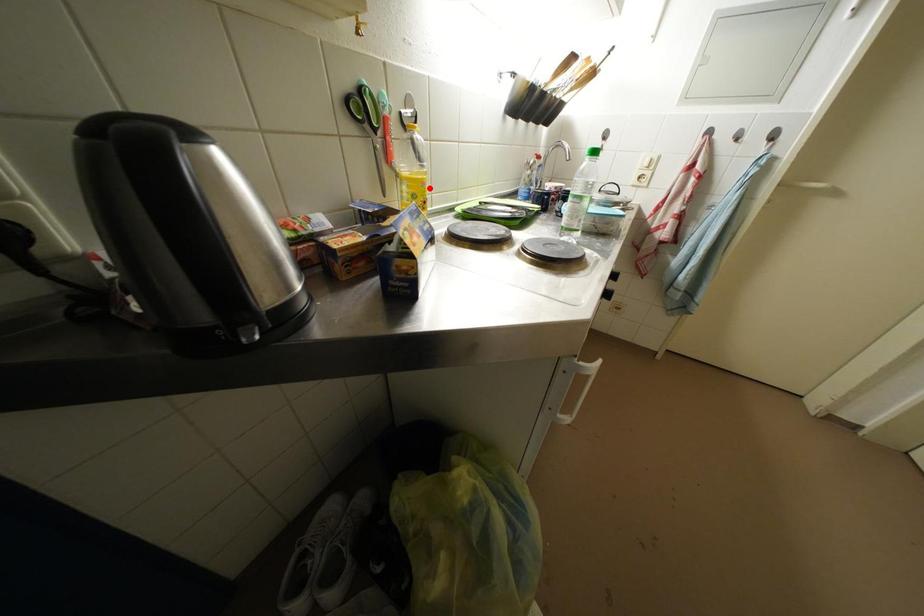
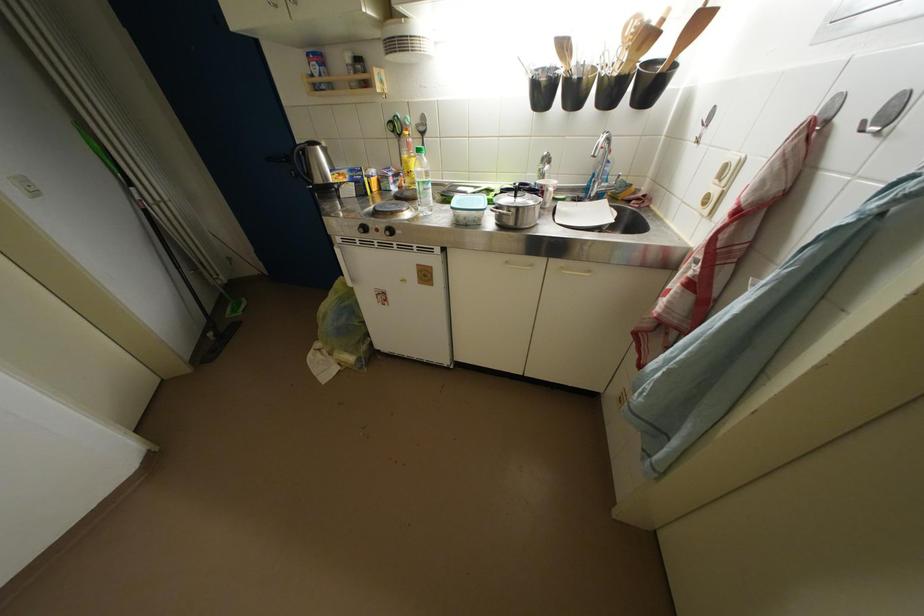
In the second image, find the point that corresponds to the highlighted location in the first image.

(412, 167)